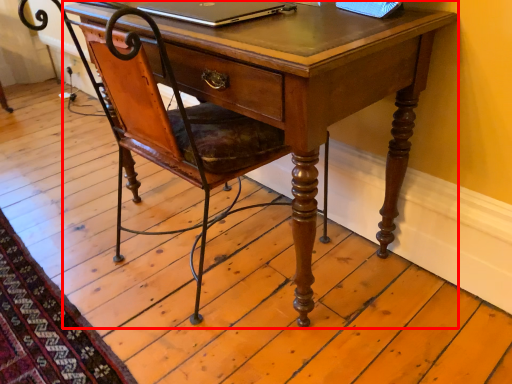
Question: Where is desk (annotated by the red box) located in relation to laptop in the image?

Choices:
 (A) left
 (B) right

Answer: (B)